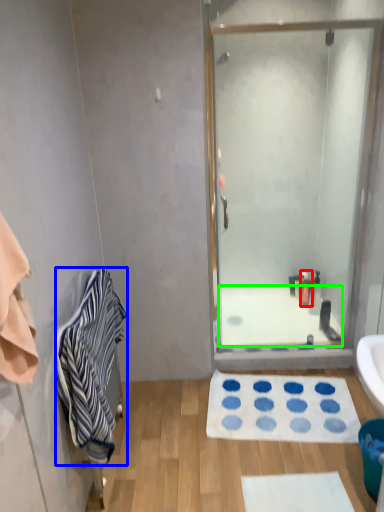
Question: Based on their relative distances, which object is nearer to toiletry (highlighted by a red box)? Choose from towel/napkin (highlighted by a blue box) and bath (highlighted by a green box).

Choices:
 (A) towel/napkin
 (B) bath

Answer: (B)